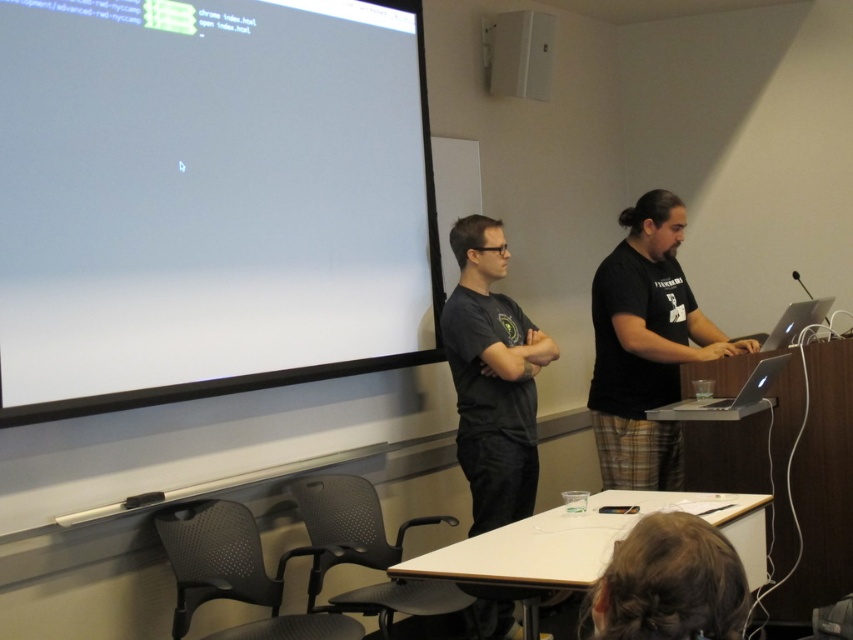
You are a photographer standing at the camera position. You want to take a closeup of the brown hair at lower center without moving the camera. Is it possible?

The brown hair at lower center is 3.54 feet away from camera, so it is possible to take a closeup without moving the camera if the camera has sufficient zoom capability.

You are a student in the classroom and need to locate the white glossy projection screen at upper left. Can you see the point at coordinates (207, 196) on it?

Yes, the point at coordinates (207, 196) is located on the white glossy projection screen at upper left as described.

Consider the image. You are a student sitting at the back of the classroom. You want to see the presentation clearly. Which object, the white glossy projection screen at upper left or the brown hair at lower center, is more likely to block your view?

The white glossy projection screen at upper left is much taller than the brown hair at lower center, so it is more likely to block your view.